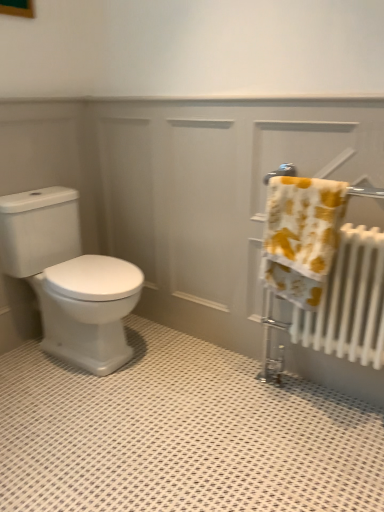
Question: Is white glossy toilet at left oriented towards yellow printed towel at right?

Choices:
 (A) yes
 (B) no

Answer: (A)

Question: Is white glossy toilet at left taller than yellow printed towel at right?

Choices:
 (A) yes
 (B) no

Answer: (A)

Question: Is white glossy toilet at left directly adjacent to yellow printed towel at right?

Choices:
 (A) yes
 (B) no

Answer: (B)

Question: From the image's perspective, is white glossy toilet at left below yellow printed towel at right?

Choices:
 (A) no
 (B) yes

Answer: (B)

Question: Is white glossy toilet at left oriented away from yellow printed towel at right?

Choices:
 (A) no
 (B) yes

Answer: (A)

Question: Is point 114,216 closer or farther from the camera than point 279,200?

Choices:
 (A) farther
 (B) closer

Answer: (A)

Question: Visually, is white glossy radiator at right positioned to the left or to the right of yellow printed towel at right?

Choices:
 (A) right
 (B) left

Answer: (B)

Question: From a real-world perspective, is white glossy radiator at right positioned above or below yellow printed towel at right?

Choices:
 (A) above
 (B) below

Answer: (B)

Question: Is white glossy radiator at right inside or outside of yellow printed towel at right?

Choices:
 (A) inside
 (B) outside

Answer: (B)

Question: In terms of height, does white glossy toilet at left look taller or shorter compared to white glossy radiator at right?

Choices:
 (A) tall
 (B) short

Answer: (B)

Question: Do you think white glossy toilet at left is within white glossy radiator at right, or outside of it?

Choices:
 (A) inside
 (B) outside

Answer: (B)

Question: From the image's perspective, is white glossy toilet at left located above or below white glossy radiator at right?

Choices:
 (A) above
 (B) below

Answer: (B)

Question: Considering the positions of point (96, 352) and point (322, 121), is point (96, 352) closer or farther from the camera than point (322, 121)?

Choices:
 (A) closer
 (B) farther

Answer: (B)

Question: From a real-world perspective, is yellow printed towel at right positioned above or below white glossy toilet at left?

Choices:
 (A) above
 (B) below

Answer: (A)

Question: From the image's perspective, is yellow printed towel at right positioned above or below white glossy toilet at left?

Choices:
 (A) above
 (B) below

Answer: (A)